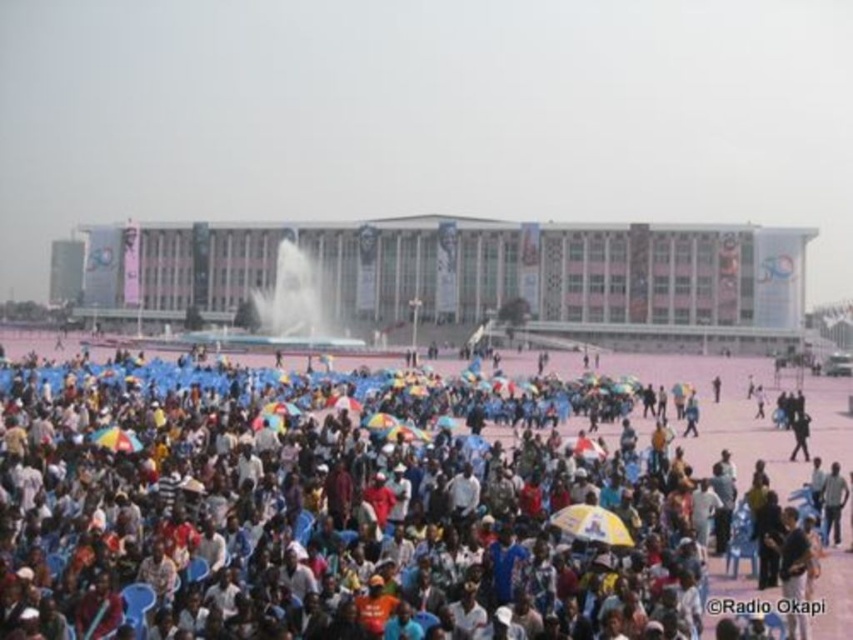
You are a photographer standing at the edge of the crowd holding a camera. You want to take a photo of the white frothy water at center. Where should you aim your camera to capture it in the frame?

You should aim your camera at point 0.481 on the x axis and 0.335 on the y axis to capture the white frothy water at center in the frame.